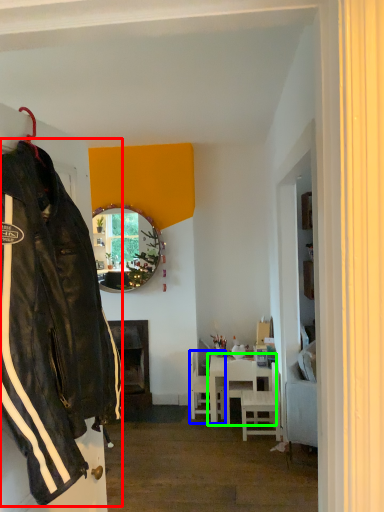
Question: Estimate the real-world distances between objects in this image. Which object is closer to jacket (highlighted by a red box), chair (highlighted by a blue box) or table (highlighted by a green box)?

Choices:
 (A) chair
 (B) table

Answer: (B)